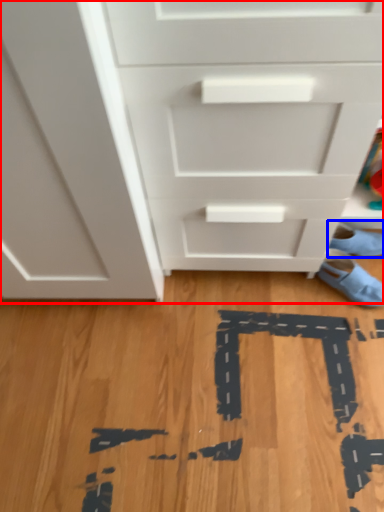
Question: Which object appears closest to the camera in this image, chest of drawers (highlighted by a red box) or footwear (highlighted by a blue box)?

Choices:
 (A) chest of drawers
 (B) footwear

Answer: (A)